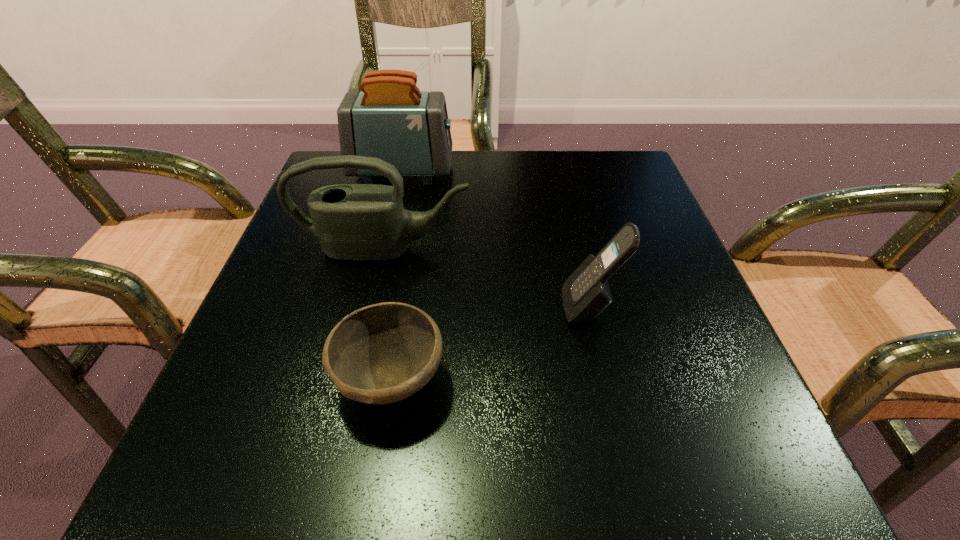
The height and width of the screenshot is (540, 960). I want to click on vacant space situated on the front-facing side of the third farthest object, so click(x=384, y=306).

Locate an element on the screen. The image size is (960, 540). vacant position located 0.080m on the right of the nearest object is located at coordinates (501, 381).

Locate an element on the screen. object present at the far edge is located at coordinates (391, 119).

Image resolution: width=960 pixels, height=540 pixels. I want to click on object located at the near edge, so click(x=382, y=353).

Where is `toaster located in the left edge section of the desktop`? This screenshot has width=960, height=540. toaster located in the left edge section of the desktop is located at coordinates (391, 119).

Find the location of a particular element. watering can at the left edge is located at coordinates (362, 222).

I want to click on object at the right edge, so click(x=586, y=293).

I want to click on object present at the far left corner, so click(391, 119).

I want to click on free location at the far edge of the desktop, so click(x=452, y=158).

This screenshot has height=540, width=960. In order to click on free space at the near edge of the desktop in this screenshot , I will do `click(564, 455)`.